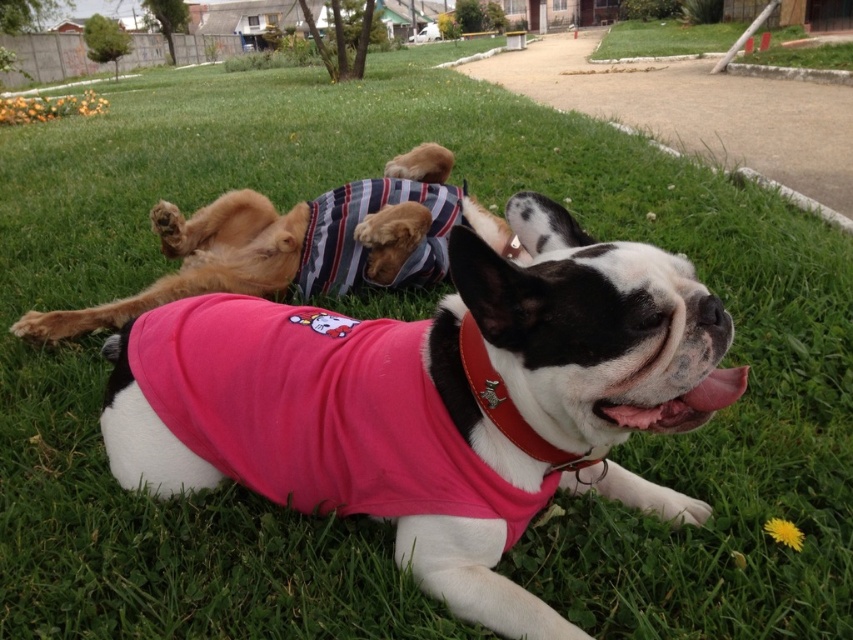
You are a dog owner who wants to ensure the safety of your pets. Looking at the image, which object is bigger between the striped fabric dog at upper center and the red leather collar at center?

The striped fabric dog at upper center is larger in size than the red leather collar at center, so the dog is bigger than the collar.

You are a photographer trying to capture a clear shot of the red leather collar at center. However, the striped fabric dog at upper center is blocking your view. Can you adjust your position to see the collar without moving the dog?

The red leather collar at center is behind the striped fabric dog at upper center, so you need to move around the dog to get a clear view of the collar.

You are standing in the grassy area where the two dogs are resting. You want to place a small treat between the two points marked as point (379,240) and point (462,356). Which point should you place the treat closer to so that it is nearer to the French Bulldog wearing the pink Hello Kitty shirt?

You should place the treat closer to point (379,240) because it is closer to the French Bulldog wearing the pink Hello Kitty shirt as it is nearer to the viewer compared to point (462,356).